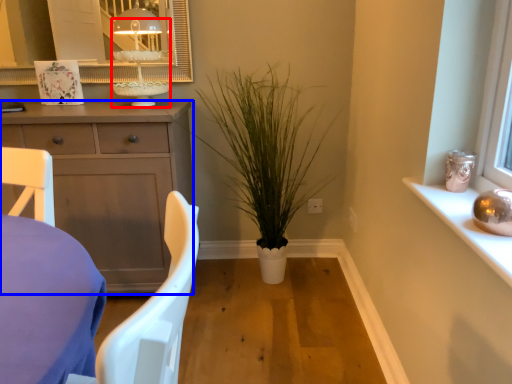
Question: Among these objects, which one is nearest to the camera, candle holder (highlighted by a red box) or cabinetry (highlighted by a blue box)?

Choices:
 (A) candle holder
 (B) cabinetry

Answer: (B)